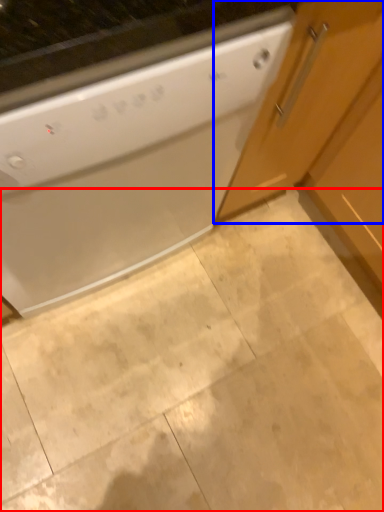
Question: Among these objects, which one is nearest to the camera, granite (highlighted by a red box) or cabinetry (highlighted by a blue box)?

Choices:
 (A) granite
 (B) cabinetry

Answer: (B)